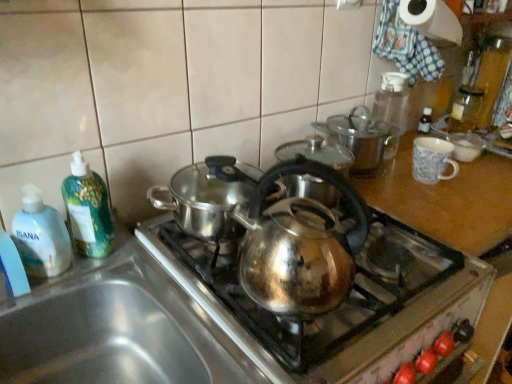
The height and width of the screenshot is (384, 512). What do you see at coordinates (329, 312) in the screenshot? I see `shiny metallic kettle at center` at bounding box center [329, 312].

Describe the element at coordinates (41, 236) in the screenshot. I see `translucent plastic soap dispenser at left, the fourth bottle from the right` at that location.

Describe the element at coordinates (465, 110) in the screenshot. This screenshot has width=512, height=384. I see `transparent glass bottle at upper right, which is the 4th bottle in left-to-right order` at that location.

Image resolution: width=512 pixels, height=384 pixels. Find the location of `green plastic bottle at left, the 3th bottle in the back-to-front sequence`. green plastic bottle at left, the 3th bottle in the back-to-front sequence is located at coordinates click(87, 210).

Where is `transparent plastic bottle at upper right, which ranks as the 2th bottle in right-to-left order`? Image resolution: width=512 pixels, height=384 pixels. transparent plastic bottle at upper right, which ranks as the 2th bottle in right-to-left order is located at coordinates (391, 109).

The height and width of the screenshot is (384, 512). What do you see at coordinates (362, 139) in the screenshot?
I see `shiny metallic pot at upper center` at bounding box center [362, 139].

The width and height of the screenshot is (512, 384). What are the coordinates of `white paper towel at upper right` in the screenshot? It's located at (432, 21).

Is point (369, 140) positioned before point (101, 249)?

No, (369, 140) is further to viewer.

Is shiny metallic pot at upper center facing away from green plastic bottle at left, the 3th bottle in the right-to-left sequence?

shiny metallic pot at upper center is not turned away from green plastic bottle at left, the 3th bottle in the right-to-left sequence.

Is shiny metallic pot at upper center to the left of green plastic bottle at left, arranged as the second bottle when viewed from the left, from the viewer's perspective?

Incorrect, shiny metallic pot at upper center is not on the left side of green plastic bottle at left, arranged as the second bottle when viewed from the left.

From the picture: Is translucent plastic soap dispenser at left, the fourth bottle from the right, smaller than shiny metallic pot at upper center?

Yes.

Which object is thinner, translucent plastic soap dispenser at left, acting as the 4th bottle starting from the back, or shiny metallic pot at upper center?

translucent plastic soap dispenser at left, acting as the 4th bottle starting from the back, is thinner.

From a real-world perspective, is translucent plastic soap dispenser at left, which is the 1th bottle in front-to-back order, on top of shiny metallic pot at upper center?

No.

From a real-world perspective, is transparent plastic bottle at upper right, which appears as the second bottle when viewed from the back, positioned above or below shiny metallic kettle at center?

From a real-world perspective, transparent plastic bottle at upper right, which appears as the second bottle when viewed from the back, is physically above shiny metallic kettle at center.

Could you tell me if transparent plastic bottle at upper right, which ranks as the 2th bottle in right-to-left order, is facing shiny metallic kettle at center?

No, transparent plastic bottle at upper right, which ranks as the 2th bottle in right-to-left order, does not turn towards shiny metallic kettle at center.

Which bottle is the 3rd one when counting from the back of the shiny metallic kettle at center? Please provide its 2D coordinates.

[(391, 109)]

Does transparent plastic bottle at upper right, which ranks as the 2th bottle in right-to-left order, appear on the right side of shiny metallic kettle at center?

Correct, you'll find transparent plastic bottle at upper right, which ranks as the 2th bottle in right-to-left order, to the right of shiny metallic kettle at center.

Can you confirm if white paper towel at upper right is wider than transparent glass bottle at upper right, arranged as the first bottle when viewed from the back?

Yes.

Is white paper towel at upper right beside transparent glass bottle at upper right, the 1th bottle in the right-to-left sequence?

No.

Where is `bottle that is the 2nd object located behind the white paper towel at upper right`? The image size is (512, 384). bottle that is the 2nd object located behind the white paper towel at upper right is located at coordinates (465, 110).

Is shiny metallic pot at upper center taller or shorter than transparent glass bottle at upper right, the 1th bottle in the right-to-left sequence?

Considering their sizes, shiny metallic pot at upper center has more height than transparent glass bottle at upper right, the 1th bottle in the right-to-left sequence.

Identify the location of kitchen appliance located on the left of transparent glass bottle at upper right, arranged as the first bottle when viewed from the back. This screenshot has width=512, height=384. (362, 139).

Is shiny metallic pot at upper center with transparent glass bottle at upper right, the 1th bottle in the right-to-left sequence?

No, shiny metallic pot at upper center is not touching transparent glass bottle at upper right, the 1th bottle in the right-to-left sequence.

Considering the positions of objects transparent glass bottle at upper right, arranged as the first bottle when viewed from the back, and transparent plastic bottle at upper right, which ranks as the 2th bottle in right-to-left order, in the image provided, who is more to the left, transparent glass bottle at upper right, arranged as the first bottle when viewed from the back, or transparent plastic bottle at upper right, which ranks as the 2th bottle in right-to-left order,?

transparent plastic bottle at upper right, which ranks as the 2th bottle in right-to-left order.

From the image's perspective, which one is positioned lower, transparent glass bottle at upper right, arranged as the first bottle when viewed from the back, or transparent plastic bottle at upper right, which appears as the second bottle when viewed from the back?

transparent plastic bottle at upper right, which appears as the second bottle when viewed from the back, appears lower in the image.

Could you tell me if transparent glass bottle at upper right, arranged as the first bottle when viewed from the back, is facing transparent plastic bottle at upper right, the third bottle positioned from the front?

No, transparent glass bottle at upper right, arranged as the first bottle when viewed from the back, does not turn towards transparent plastic bottle at upper right, the third bottle positioned from the front.

Considering the positions of objects green plastic bottle at left, the 3th bottle in the right-to-left sequence, and transparent plastic bottle at upper right, which is the third bottle from left to right, in the image provided, who is behind, green plastic bottle at left, the 3th bottle in the right-to-left sequence, or transparent plastic bottle at upper right, which is the third bottle from left to right,?

transparent plastic bottle at upper right, which is the third bottle from left to right, is behind.

Does point (73, 181) appear closer or farther from the camera than point (384, 112)?

Point (73, 181) appears to be closer to the viewer than point (384, 112).

From the image's perspective, is green plastic bottle at left, the 3th bottle in the right-to-left sequence, above transparent plastic bottle at upper right, which ranks as the 2th bottle in right-to-left order?

No, from the image's perspective, green plastic bottle at left, the 3th bottle in the right-to-left sequence, is not over transparent plastic bottle at upper right, which ranks as the 2th bottle in right-to-left order.

In terms of height, does green plastic bottle at left, the 3th bottle in the right-to-left sequence, look taller or shorter compared to transparent plastic bottle at upper right, which is the third bottle from left to right?

In the image, green plastic bottle at left, the 3th bottle in the right-to-left sequence, appears to be shorter than transparent plastic bottle at upper right, which is the third bottle from left to right.

At what (x,y) coordinates should I click in order to perform the action: click on kitchen appliance below the green plastic bottle at left, the 3th bottle in the back-to-front sequence (from a real-world perspective). Please return your answer as a coordinate pair (x, y). The width and height of the screenshot is (512, 384). Looking at the image, I should click on (362, 139).

Which bottle is the 2nd one when counting from the front of the shiny metallic pot at upper center? Please provide its 2D coordinates.

[(41, 236)]

Which object lies nearer to the anchor point shiny metallic pot at upper center, translucent plastic soap dispenser at left, the first bottle when ordered from left to right, or green plastic bottle at left, which is the second bottle from front to back?

green plastic bottle at left, which is the second bottle from front to back.

From the picture: Considering their positions, is shiny metallic pot at upper center positioned further to transparent glass bottle at upper right, which appears as the fourth bottle when viewed from the front, than white paper towel at upper right?

shiny metallic pot at upper center.

Looking at this image, which object lies further to the anchor point shiny metallic pot at upper center, transparent glass bottle at upper right, which is the 4th bottle in left-to-right order, or transparent plastic bottle at upper right, which appears as the second bottle when viewed from the back?

The object further to shiny metallic pot at upper center is transparent glass bottle at upper right, which is the 4th bottle in left-to-right order.

Based on their spatial positions, is shiny metallic kettle at center or white paper towel at upper right closer to shiny metallic pot at upper center?

white paper towel at upper right is closer to shiny metallic pot at upper center.

Based on the photo, looking at the image, which one is located closer to transparent glass bottle at upper right, which appears as the fourth bottle when viewed from the front, white paper towel at upper right or transparent plastic bottle at upper right, which is the third bottle from left to right?

transparent plastic bottle at upper right, which is the third bottle from left to right, is closer to transparent glass bottle at upper right, which appears as the fourth bottle when viewed from the front.

Considering their positions, is shiny metallic pot at upper center positioned further to stainless steel sink at lower left than transparent plastic bottle at upper right, the third bottle positioned from the front?

transparent plastic bottle at upper right, the third bottle positioned from the front.

From the image, which object appears to be nearer to transparent plastic bottle at upper right, which ranks as the 2th bottle in right-to-left order, green plastic bottle at left, the 3th bottle in the right-to-left sequence, or shiny metallic pot at upper center?

shiny metallic pot at upper center lies closer to transparent plastic bottle at upper right, which ranks as the 2th bottle in right-to-left order, than the other object.

In the scene shown: Looking at the image, which one is located further to translucent plastic soap dispenser at left, which is the 1th bottle in front-to-back order, shiny metallic pot at upper center or transparent glass bottle at upper right, which is the 4th bottle in left-to-right order?

Based on the image, transparent glass bottle at upper right, which is the 4th bottle in left-to-right order, appears to be further to translucent plastic soap dispenser at left, which is the 1th bottle in front-to-back order.

You are a GUI agent. You are given a task and a screenshot of the screen. Output one action in this format:
    pyautogui.click(x=<x>, y=<y>)
    Task: Click on the bottle between translucent plastic soap dispenser at left, acting as the 4th bottle starting from the back, and shiny metallic pot at upper center, in the horizontal direction
    
    Given the screenshot: What is the action you would take?
    pyautogui.click(x=87, y=210)

Where is `sink between green plastic bottle at left, arranged as the second bottle when viewed from the left, and white paper towel at upper right from left to right`? The height and width of the screenshot is (384, 512). sink between green plastic bottle at left, arranged as the second bottle when viewed from the left, and white paper towel at upper right from left to right is located at coordinates (116, 328).

This screenshot has height=384, width=512. In order to click on kitchen appliance that lies between white paper towel at upper right and stainless steel sink at lower left from top to bottom in this screenshot , I will do coord(362,139).

The width and height of the screenshot is (512, 384). I want to click on bottle located between white paper towel at upper right and transparent glass bottle at upper right, which appears as the fourth bottle when viewed from the front, in the depth direction, so (391, 109).